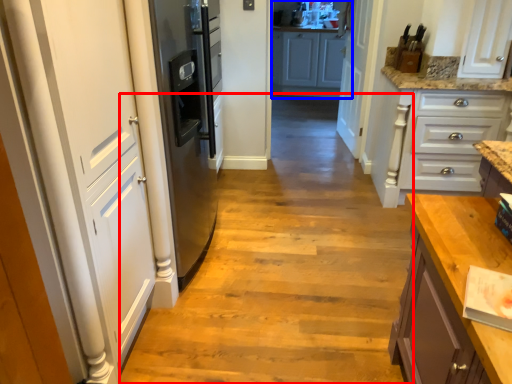
Question: Which of the following is the closest to the observer, path (highlighted by a red box) or cabinetry (highlighted by a blue box)?

Choices:
 (A) path
 (B) cabinetry

Answer: (A)